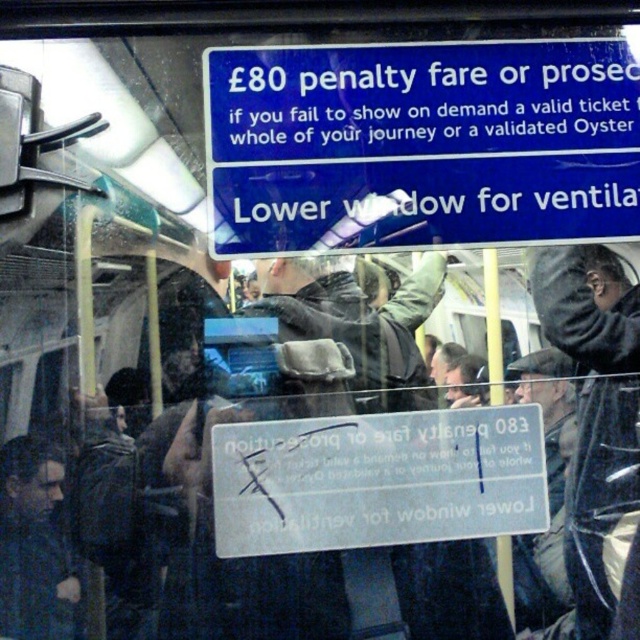
Which is above, blue plastic sign at upper center or white plastic sign at center?

blue plastic sign at upper center

Does blue plastic sign at upper center appear on the left side of white plastic sign at center?

No, blue plastic sign at upper center is not to the left of white plastic sign at center.

Between point (524, 116) and point (216, 480), which one is positioned in front?

Point (216, 480) is in front.

This screenshot has width=640, height=640. I want to click on blue plastic sign at upper center, so click(x=420, y=144).